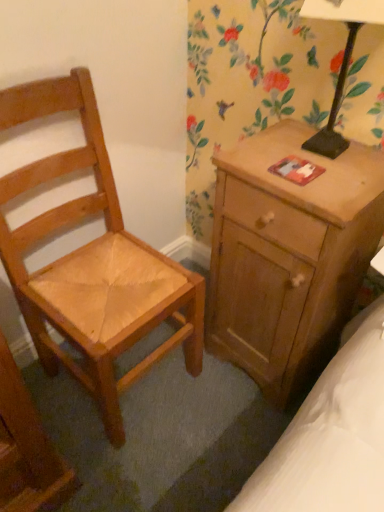
What do you see at coordinates (342, 61) in the screenshot? The width and height of the screenshot is (384, 512). I see `black metal table lamp at upper right` at bounding box center [342, 61].

Find the location of a particular element. wooden nightstand at right is located at coordinates (288, 256).

How much distance is there between black metal table lamp at upper right and wooden nightstand at right?

The distance of black metal table lamp at upper right from wooden nightstand at right is 33.03 centimeters.

Is black metal table lamp at upper right far from wooden nightstand at right?

They are positioned close to each other.

Which object is further away from the camera taking this photo, black metal table lamp at upper right or wooden nightstand at right?

wooden nightstand at right is further away from the camera.

Considering the sizes of objects black metal table lamp at upper right and wooden nightstand at right in the image provided, who is bigger, black metal table lamp at upper right or wooden nightstand at right?

With larger size is wooden nightstand at right.

Between point (70, 154) and point (356, 15), which one is positioned in front?

Point (356, 15)

From their relative heights in the image, would you say light brown wooden chair at left is taller or shorter than black metal table lamp at upper right?

Clearly, light brown wooden chair at left is taller compared to black metal table lamp at upper right.

Based on their sizes in the image, would you say light brown wooden chair at left is bigger or smaller than black metal table lamp at upper right?

In the image, light brown wooden chair at left appears to be larger than black metal table lamp at upper right.

Is wooden nightstand at right completely or partially inside light brown wooden chair at left?

No, wooden nightstand at right is not surrounded by light brown wooden chair at left.

Is light brown wooden chair at left aimed at wooden nightstand at right?

No, light brown wooden chair at left is not turned towards wooden nightstand at right.

Can you tell me how much light brown wooden chair at left and wooden nightstand at right differ in facing direction?

89.6 degrees separate the facing orientations of light brown wooden chair at left and wooden nightstand at right.

From the image's perspective, relative to wooden nightstand at right, is light brown wooden chair at left above or below?

From the image's perspective, light brown wooden chair at left appears above wooden nightstand at right.

Is light brown wooden chair at left inside black metal table lamp at upper right?

No, black metal table lamp at upper right does not contain light brown wooden chair at left.

Locate an element on the screen. This screenshot has height=512, width=384. chair on the left side of black metal table lamp at upper right is located at coordinates (91, 261).

Between black metal table lamp at upper right and light brown wooden chair at left, which one has larger width?

light brown wooden chair at left.

Who is bigger, black metal table lamp at upper right or light brown wooden chair at left?

light brown wooden chair at left.

In the image, is wooden nightstand at right positioned in front of or behind black metal table lamp at upper right?

wooden nightstand at right is positioned farther from the viewer than black metal table lamp at upper right.

In terms of height, does wooden nightstand at right look taller or shorter compared to black metal table lamp at upper right?

Considering their sizes, wooden nightstand at right has more height than black metal table lamp at upper right.

Which is more to the right, wooden nightstand at right or black metal table lamp at upper right?

From the viewer's perspective, black metal table lamp at upper right appears more on the right side.

Identify the location of table lamp on the right of wooden nightstand at right. (342, 61).

From a real-world perspective, relative to light brown wooden chair at left, is wooden nightstand at right vertically above or below?

From a real-world perspective, wooden nightstand at right is physically below light brown wooden chair at left.

Is wooden nightstand at right thinner than light brown wooden chair at left?

Correct, the width of wooden nightstand at right is less than that of light brown wooden chair at left.

From the image's perspective, is wooden nightstand at right above or below light brown wooden chair at left?

wooden nightstand at right is situated lower than light brown wooden chair at left in the image.

Is light brown wooden chair at left at the back of wooden nightstand at right?

wooden nightstand at right does not have its back to light brown wooden chair at left.

This screenshot has width=384, height=512. In order to click on nightstand that is below the black metal table lamp at upper right (from the image's perspective) in this screenshot , I will do click(x=288, y=256).

Find the location of a particular element. chair beneath the black metal table lamp at upper right (from a real-world perspective) is located at coordinates (91, 261).

Estimate the real-world distances between objects in this image. Which object is further from light brown wooden chair at left, black metal table lamp at upper right or wooden nightstand at right?

The object further to light brown wooden chair at left is black metal table lamp at upper right.

Looking at this image, estimate the real-world distances between objects in this image. Which object is closer to wooden nightstand at right, black metal table lamp at upper right or light brown wooden chair at left?

Based on the image, black metal table lamp at upper right appears to be nearer to wooden nightstand at right.

When comparing their distances from black metal table lamp at upper right, does wooden nightstand at right or light brown wooden chair at left seem closer?

wooden nightstand at right.

Which object lies nearer to the anchor point black metal table lamp at upper right, light brown wooden chair at left or wooden nightstand at right?

wooden nightstand at right is positioned closer to the anchor black metal table lamp at upper right.

Looking at the image, which one is located closer to light brown wooden chair at left, wooden nightstand at right or black metal table lamp at upper right?

wooden nightstand at right is positioned closer to the anchor light brown wooden chair at left.

When comparing their distances from wooden nightstand at right, does light brown wooden chair at left or black metal table lamp at upper right seem closer?

black metal table lamp at upper right.

Where is `nightstand between light brown wooden chair at left and black metal table lamp at upper right`? Image resolution: width=384 pixels, height=512 pixels. nightstand between light brown wooden chair at left and black metal table lamp at upper right is located at coordinates (288, 256).